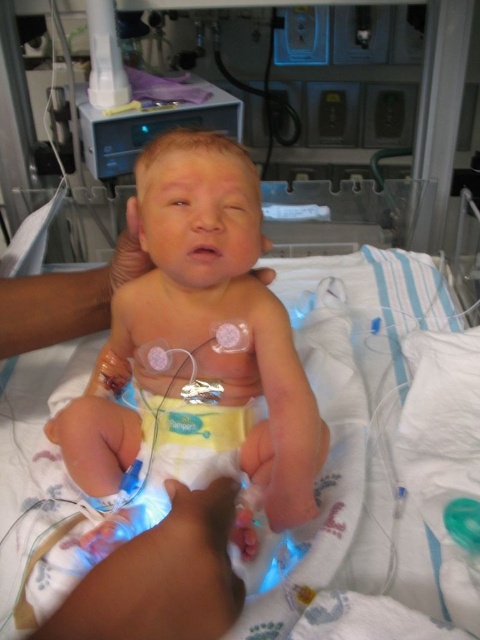
You are a nurse in the ICU and need to adjust the position of the white soft hospital bed at center so that the white soft hand at lower center can reach the baby more easily. Based on their heights, should you raise or lower the bed?

The white soft hospital bed at center is much taller than the white soft hand at lower center. To make it easier for the hand to reach the baby, you should lower the bed.

You are a nurse in the NICU and need to check the baby. Which part should you reach first, the smooth skin newborn at center or the white soft hand at lower center?

You should reach the white soft hand at lower center first because the smooth skin newborn at center is further away from you than the white soft hand at lower center.